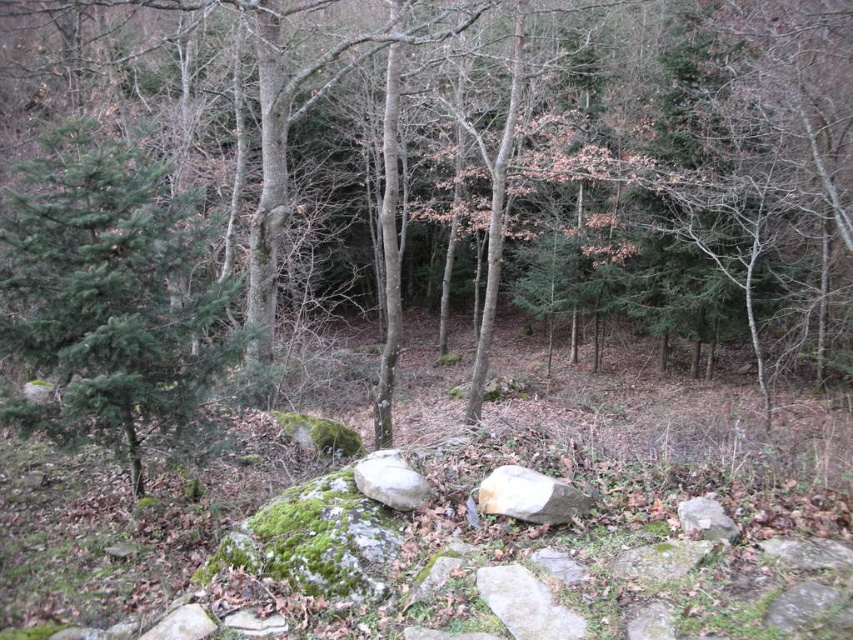
You are an explorer trying to cross a rocky path. You see a smooth beige rock at center and a smooth gray rock at center. Which rock should you step on if you want to cover more ground with each step?

The smooth beige rock at center might be wider than smooth gray rock at center, so stepping on it could allow you to cover more ground with each step.